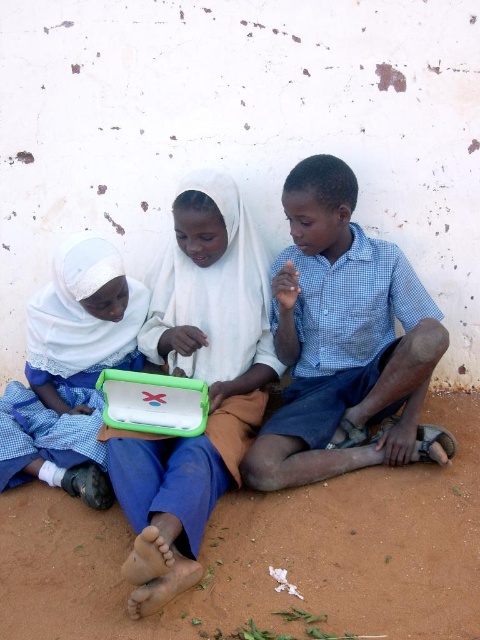
Question: Is blue checkered shirt at center closer to camera compared to matte green plastic tablet at center?

Choices:
 (A) no
 (B) yes

Answer: (B)

Question: Which point is closer to the camera taking this photo?

Choices:
 (A) (303, 321)
 (B) (33, 317)
 (C) (219, 419)

Answer: (C)

Question: In this image, where is blue checkered shirt at center located relative to green plastic tablet at center?

Choices:
 (A) below
 (B) above

Answer: (B)

Question: Which of the following is the closest to the observer?

Choices:
 (A) green plastic tablet at center
 (B) matte green plastic tablet at center
 (C) blue checkered shirt at center

Answer: (A)

Question: Which point appears farthest from the camera in this image?

Choices:
 (A) (67, 376)
 (B) (297, 209)

Answer: (A)

Question: Does blue checkered shirt at center appear under green plastic tablet at center?

Choices:
 (A) yes
 (B) no

Answer: (B)